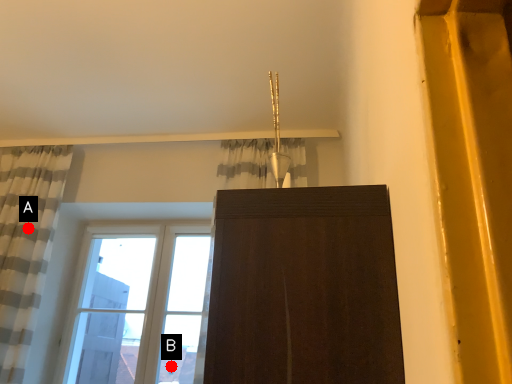
Question: Two points are circled on the image, labeled by A and B beside each circle. Which point is farther to the camera?

Choices:
 (A) A is further
 (B) B is further

Answer: (B)